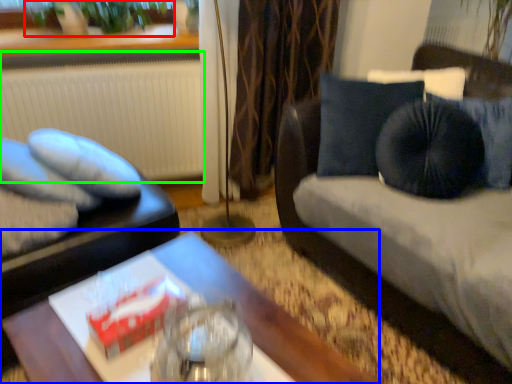
Question: Which object is positioned closest to plant (highlighted by a red box)? Select from table (highlighted by a blue box) and radiator (highlighted by a green box).

Choices:
 (A) table
 (B) radiator

Answer: (B)